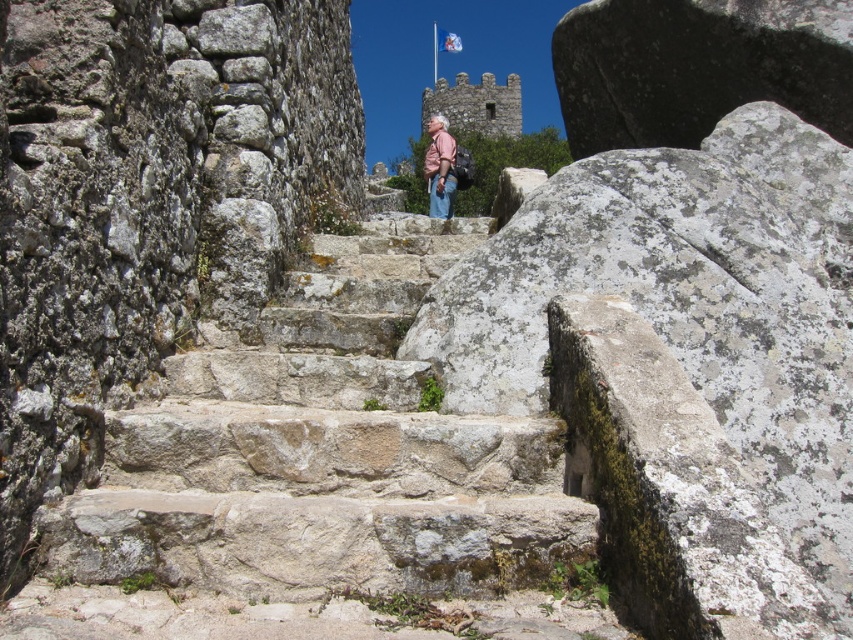
Between natural stone stairs at center and pink fabric shirt at center, which one appears on the left side from the viewer's perspective?

Positioned to the left is natural stone stairs at center.

Which is above, natural stone stairs at center or pink fabric shirt at center?

pink fabric shirt at center

Which is behind, point (207, 488) or point (428, 195)?

Point (428, 195)

Find the location of a particular element. The image size is (853, 640). natural stone stairs at center is located at coordinates (323, 454).

Does natural stone stairs at center have a smaller size compared to stone castle at upper center?

Yes, natural stone stairs at center is smaller than stone castle at upper center.

Is point (483, 234) behind point (466, 113)?

No, (483, 234) is closer to viewer.

The width and height of the screenshot is (853, 640). Identify the location of natural stone stairs at center. (323, 454).

Is point (509, 129) positioned in front of point (432, 189)?

No.

Which is in front, point (515, 83) or point (437, 216)?

Point (437, 216) is in front.

Find the location of a particular element. Image resolution: width=853 pixels, height=640 pixels. stone castle at upper center is located at coordinates (474, 104).